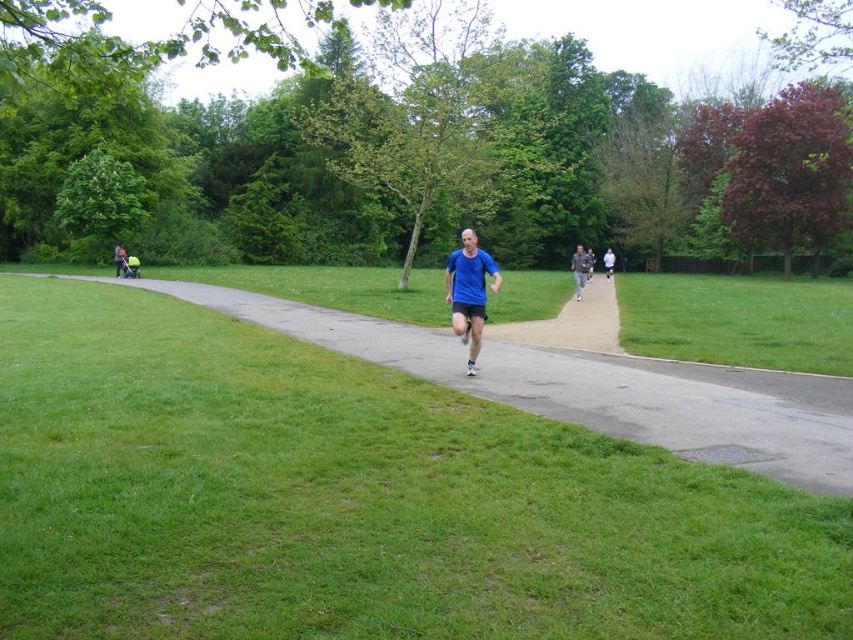
You are a photographer positioned at the edge of the grassy area, aiming to capture a photo of the dark gray jacket at center and the matte black stroller at left. Which object should you zoom in on to ensure both are clearly visible in the frame?

The dark gray jacket at center is larger in size than the matte black stroller at left, so you should zoom in on the dark gray jacket at center to ensure both are clearly visible in the frame.